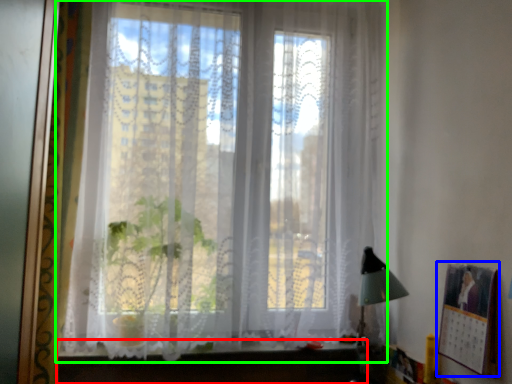
Question: Based on their relative distances, which object is farther from vanity (highlighted by a red box)? Choose from picture frame (highlighted by a blue box) and window (highlighted by a green box).

Choices:
 (A) picture frame
 (B) window

Answer: (A)